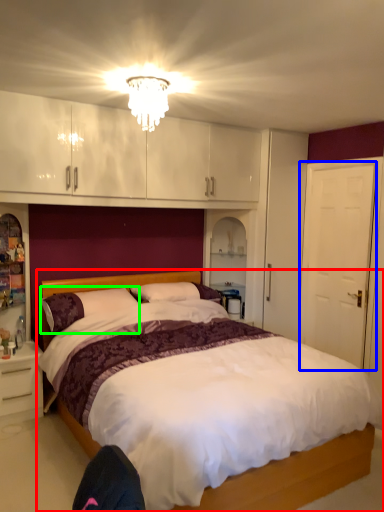
Question: Based on their relative distances, which object is nearer to bed (highlighted by a red box)? Choose from door (highlighted by a blue box) and pillow (highlighted by a green box).

Choices:
 (A) door
 (B) pillow

Answer: (A)